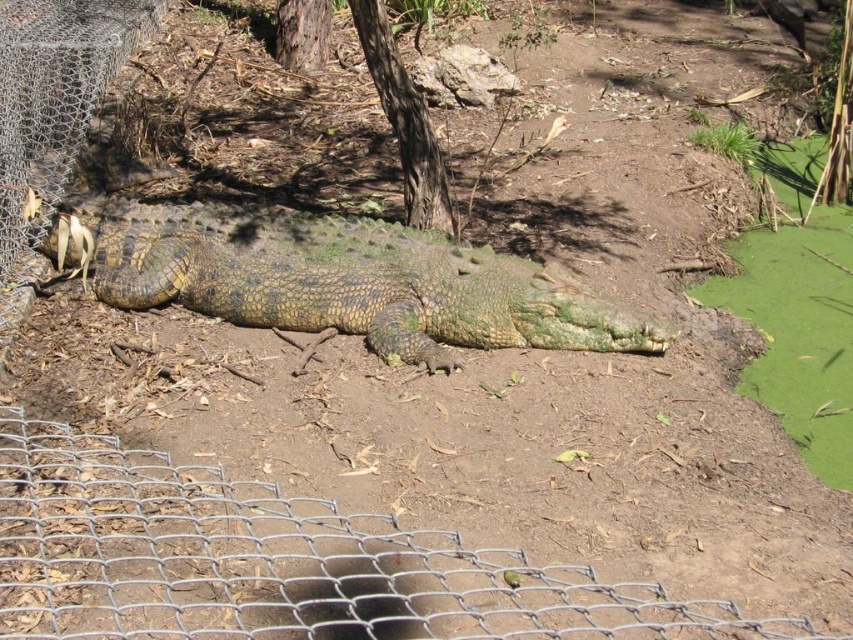
Question: Can you confirm if wire mesh fence at lower left is positioned below green scaly crocodile at center?

Choices:
 (A) yes
 (B) no

Answer: (A)

Question: Which point appears farthest from the camera in this image?

Choices:
 (A) (430, 586)
 (B) (456, 275)

Answer: (B)

Question: Which object appears closest to the camera in this image?

Choices:
 (A) green scaly crocodile at center
 (B) wire mesh fence at lower left

Answer: (B)

Question: Does wire mesh fence at lower left come behind green scaly crocodile at center?

Choices:
 (A) no
 (B) yes

Answer: (A)

Question: Among these points, which one is farthest from the camera?

Choices:
 (A) (387, 545)
 (B) (119, 276)

Answer: (B)

Question: Does wire mesh fence at lower left appear on the right side of green scaly crocodile at center?

Choices:
 (A) no
 (B) yes

Answer: (B)